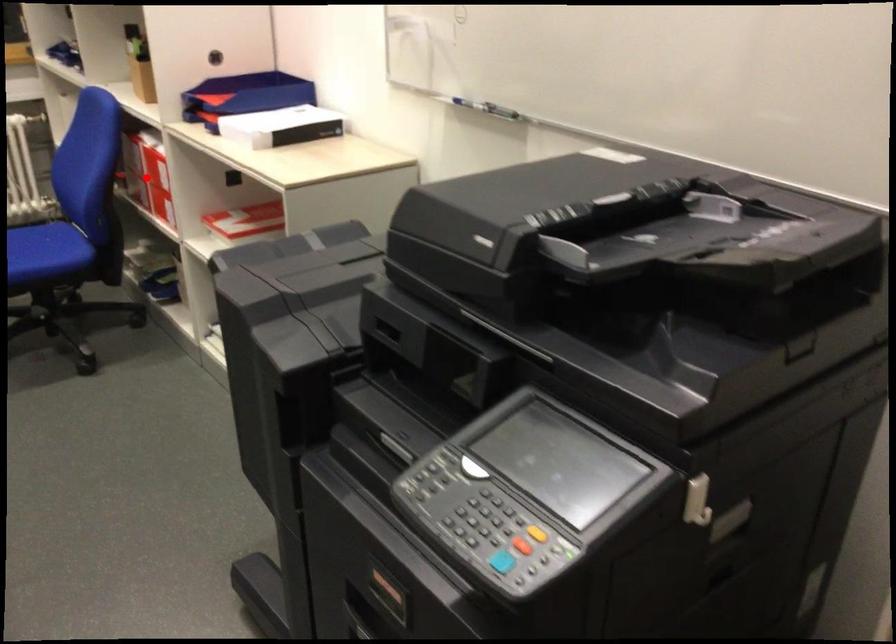
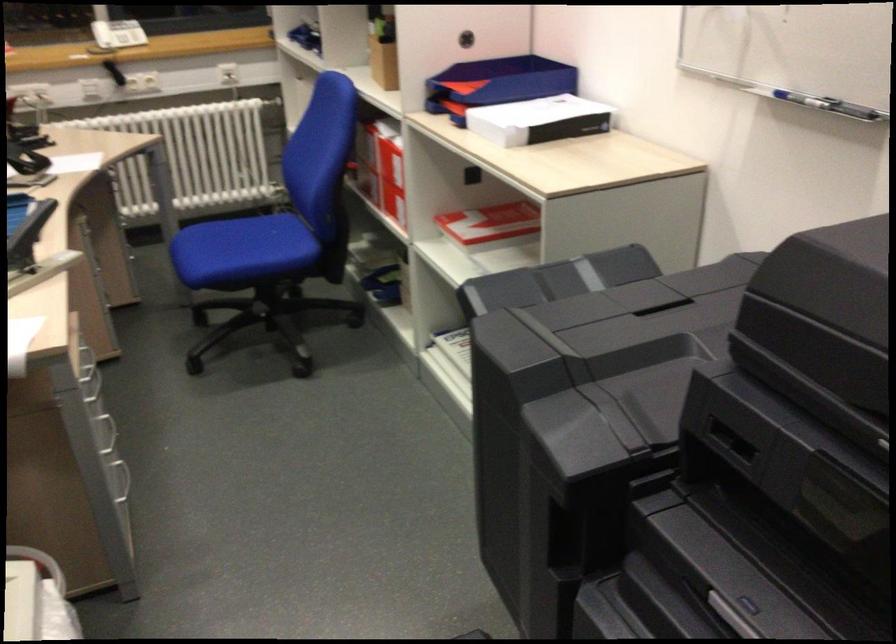
Find the pixel in the second image that matches the highlighted location in the first image.

(380, 167)